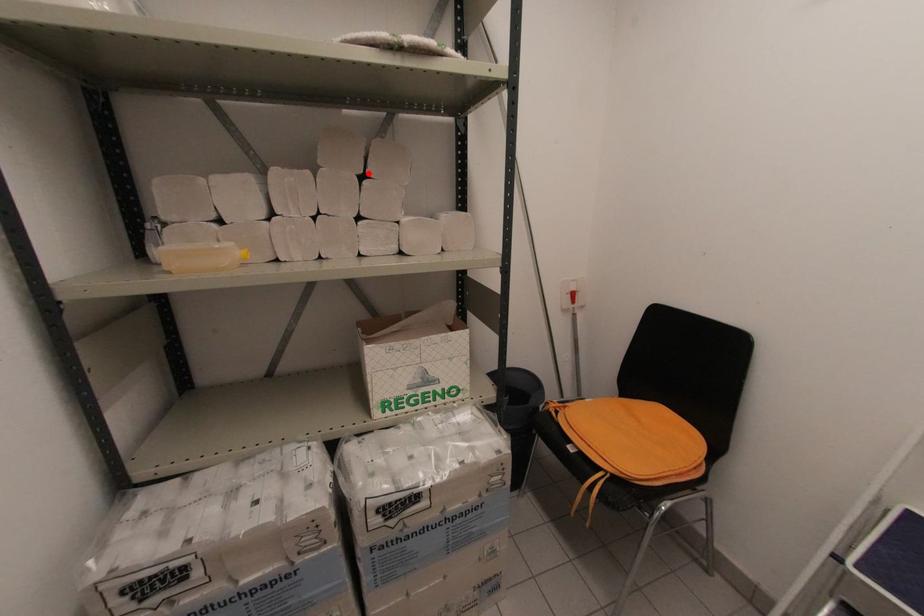
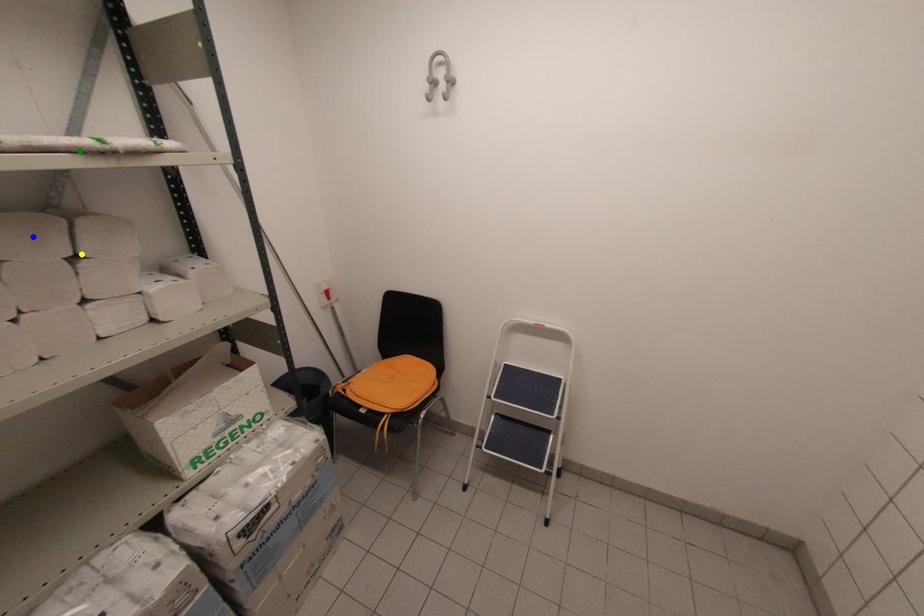
Question: I am providing you with two images of the same scene from different viewpoints. A red point is marked on the first image. You are given multiple points on the second image. Which mark in image 2 goes with the point in image 1?

Choices:
 (A) blue point
 (B) green point
 (C) yellow point

Answer: (C)